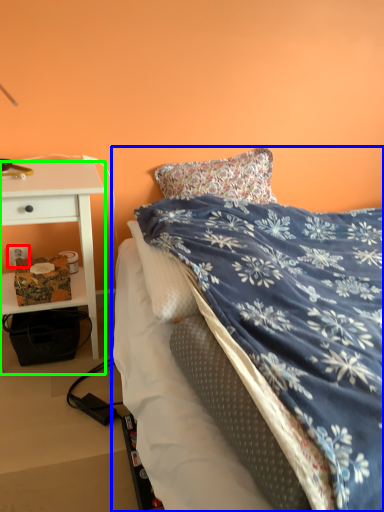
Question: Based on their relative distances, which object is farther from power outlet (highlighted by a red box)? Choose from bed (highlighted by a blue box) and desk (highlighted by a green box).

Choices:
 (A) bed
 (B) desk

Answer: (A)